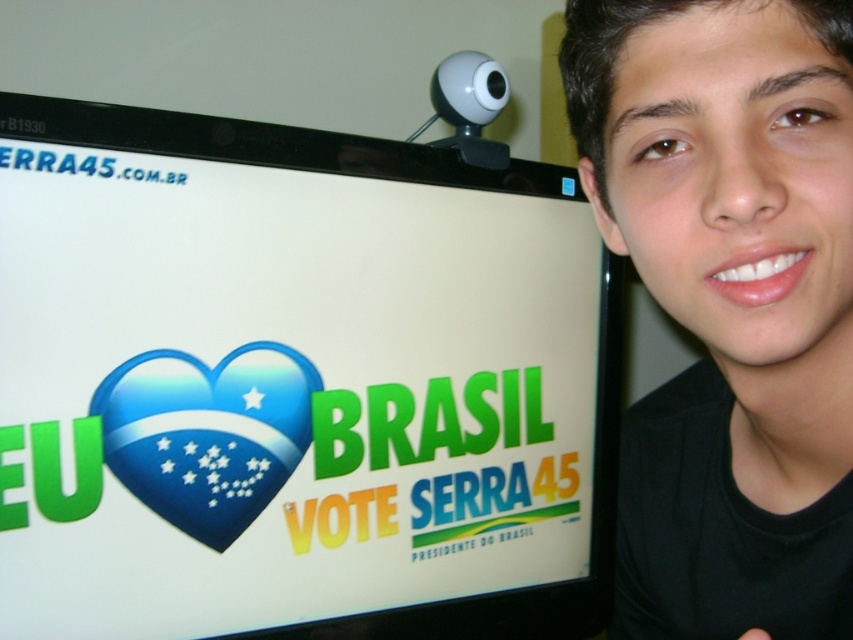
Consider the image. You are an election official checking voter ID photos. You have a standard form that requires the voter photo to show their face larger than any other object in the frame. The photo you are reviewing shows the black matte face at upper right and the white glossy computer screen at upper center. Does this photo meet the requirement?

The white glossy computer screen at upper center is wider than the black matte face at upper right. Therefore, the photo does not meet the requirement because the face is not larger than all other objects in the frame.

You are a photographer trying to capture a clear photo of the white glossy computer screen at upper center and the black matte face at upper right. Since the screen is reflecting light, you need to adjust your camera settings to avoid glare. Which object should you focus on first to ensure both are in the frame without moving the camera?

The white glossy computer screen at upper center is bigger than the black matte face at upper right, so you should focus on the larger object first to ensure it fits properly in the frame before adjusting for the smaller one.

You are a photographer trying to capture a clear shot of both the white glossy computer screen at upper center and the black matte face at upper right. Based on their positions, which object should you focus on first to ensure both are in frame?

The white glossy computer screen at upper center is to the left of the black matte face at upper right, so you should focus on the black matte face at upper right first to ensure both are in frame.